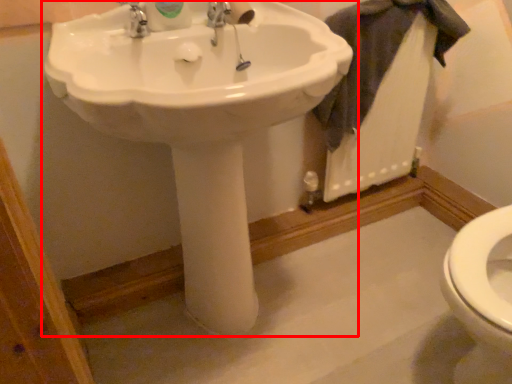
Question: From the image's perspective, where is sink (annotated by the red box) located relative to bath towel?

Choices:
 (A) above
 (B) below

Answer: (B)